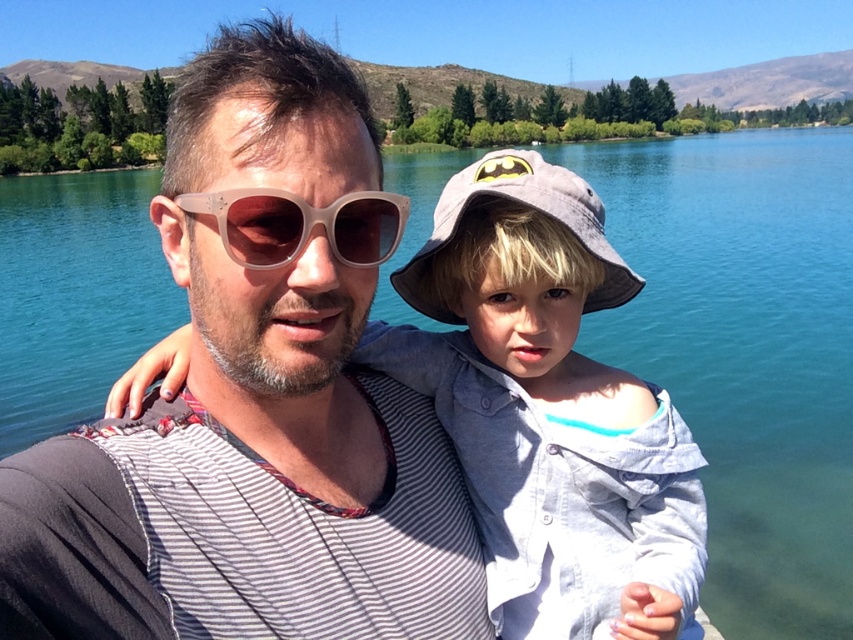
Question: Among these points, which one is nearest to the camera?

Choices:
 (A) (686, 452)
 (B) (335, 234)
 (C) (318, 532)
 (D) (608, 300)

Answer: (B)

Question: Can you confirm if matte plastic sunglasses at upper center is thinner than light gray cotton shirt at center?

Choices:
 (A) no
 (B) yes

Answer: (A)

Question: Can you confirm if gray fabric baseball hat at center is bigger than translucent plastic sunglasses at center?

Choices:
 (A) no
 (B) yes

Answer: (B)

Question: Does matte plastic sunglasses at upper center appear on the right side of translucent plastic sunglasses at center?

Choices:
 (A) no
 (B) yes

Answer: (A)

Question: Which point appears closest to the camera in this image?

Choices:
 (A) (503, 544)
 (B) (196, 481)

Answer: (B)

Question: Which object is farther from the camera taking this photo?

Choices:
 (A) matte plastic sunglasses at upper center
 (B) light gray cotton shirt at center

Answer: (B)